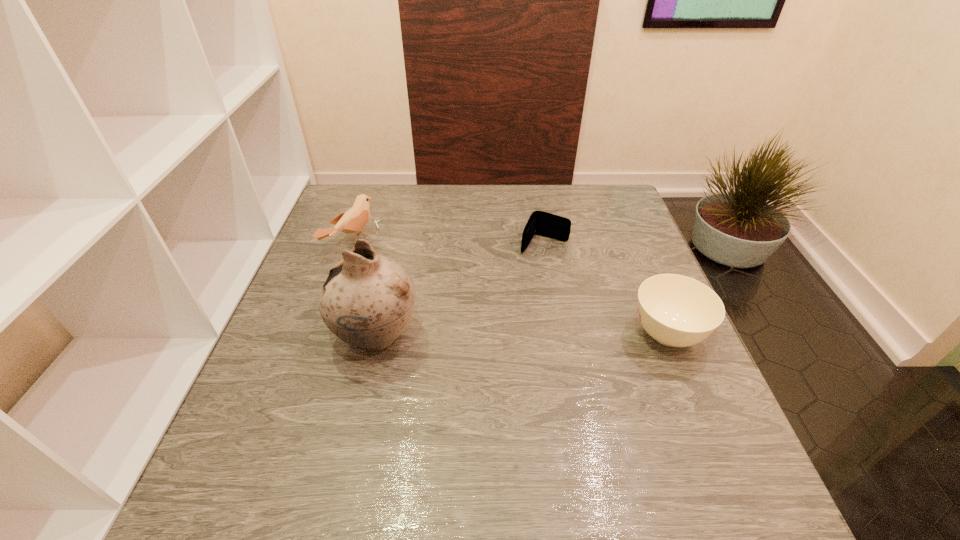
Locate an element on the screen. This screenshot has width=960, height=540. blank space located at the beak of the bird is located at coordinates (447, 289).

Find the location of a particular element. This screenshot has height=540, width=960. free point located at the beak of the bird is located at coordinates (424, 279).

I want to click on blank space located 0.190m on the outer surface of the second object from right to left, so click(512, 301).

You are a GUI agent. You are given a task and a screenshot of the screen. Output one action in this format:
    pyautogui.click(x=<x>, y=<y>)
    Task: Click on the vacant space located on the outer surface of the second object from right to left
    
    Given the screenshot: What is the action you would take?
    pyautogui.click(x=502, y=319)

Identify the location of vacant space located 0.270m on the outer surface of the second object from right to left. The image size is (960, 540). (499, 325).

At what (x,y) coordinates should I click in order to perform the action: click on object that is at the far edge. Please return your answer as a coordinate pair (x, y). The image size is (960, 540). Looking at the image, I should click on (352, 221).

Locate an element on the screen. Image resolution: width=960 pixels, height=540 pixels. pottery positioned at the left edge is located at coordinates (367, 300).

The height and width of the screenshot is (540, 960). In order to click on bird that is at the left edge in this screenshot , I will do `click(352, 221)`.

Where is `object situated at the right edge`? The height and width of the screenshot is (540, 960). object situated at the right edge is located at coordinates (x=675, y=310).

Identify the location of object that is at the far left corner. (352, 221).